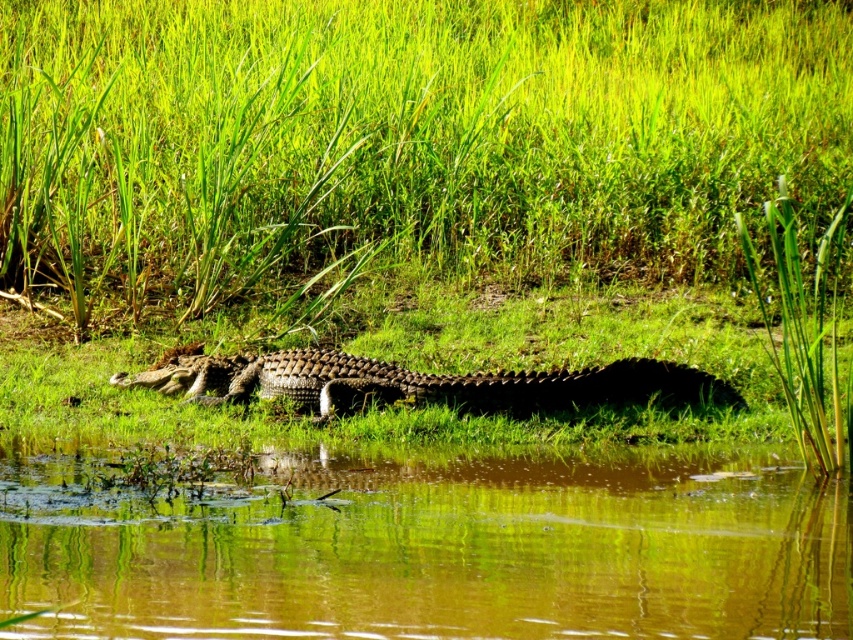
You are standing in the scene and see two points labeled as point (611,76) and point (335,396). Which point is closer to your eyes?

Point (611,76) is further to the camera than point (335,396), so the point closer to your eyes is point (335,396).

You are a small frog trying to jump from the green grass at center to the brown murky water at center. Which direction should you jump to reach the water?

The green grass at center is to the left of the brown murky water at center, so you should jump to the right to reach the water.

You are a small frog trying to jump from the green grass at center to the brown murky water at center. Which surface will be easier to jump from?

The green grass at center is much taller than the brown murky water at center, so jumping from the green grass at center would provide a better platform for the frog to launch itself into the air.